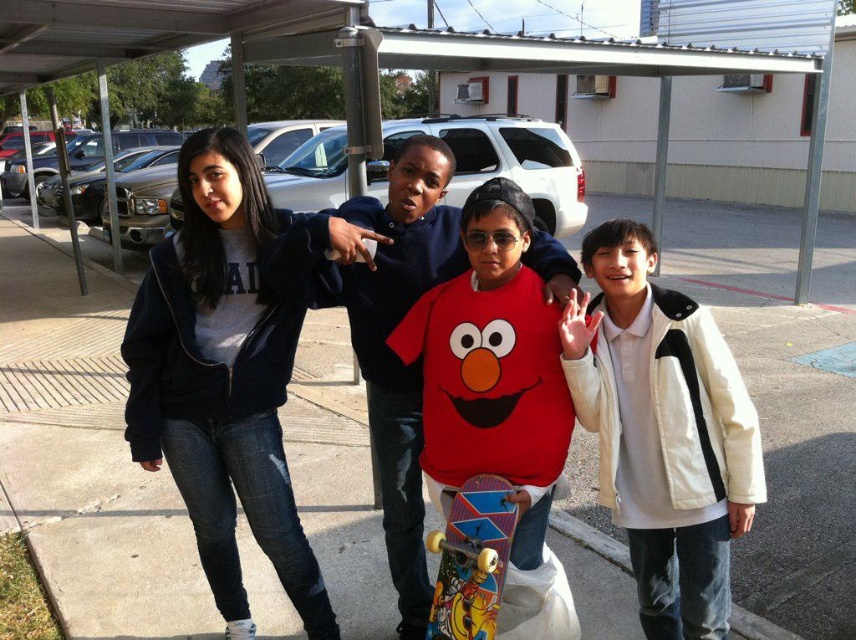
Consider the image. Who is positioned more to the left, white cotton jacket at right or multicolored plastic skateboard at center?

From the viewer's perspective, multicolored plastic skateboard at center appears more on the left side.

Does white cotton jacket at right have a larger size compared to multicolored plastic skateboard at center?

Yes, white cotton jacket at right is bigger than multicolored plastic skateboard at center.

What do you see at coordinates (663, 433) in the screenshot? I see `white cotton jacket at right` at bounding box center [663, 433].

The width and height of the screenshot is (856, 640). I want to click on white cotton jacket at right, so click(x=663, y=433).

Who is shorter, concrete at center or dark blue jacket at center?

dark blue jacket at center is shorter.

Is concrete at center bigger than dark blue jacket at center?

Yes.

Between point (87, 356) and point (265, 362), which one is positioned in front?

Point (265, 362)

Where is `concrete at center`? The height and width of the screenshot is (640, 856). concrete at center is located at coordinates (85, 454).

Between concrete at center and red matte elmo shirt at center, which one appears on the left side from the viewer's perspective?

concrete at center

Is concrete at center above red matte elmo shirt at center?

Yes, concrete at center is above red matte elmo shirt at center.

Where is `concrete at center`? The width and height of the screenshot is (856, 640). concrete at center is located at coordinates (85, 454).

You are a GUI agent. You are given a task and a screenshot of the screen. Output one action in this format:
    pyautogui.click(x=<x>, y=<y>)
    Task: Click on the concrete at center
    This screenshot has height=640, width=856.
    Given the screenshot: What is the action you would take?
    pyautogui.click(x=85, y=454)